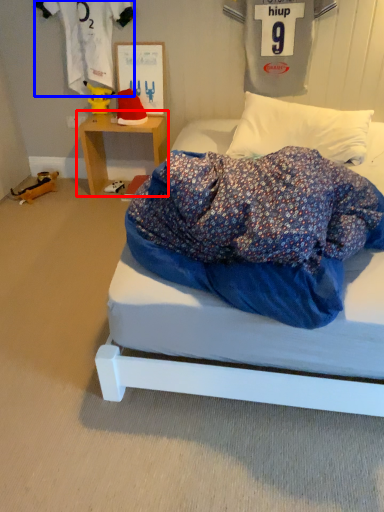
Question: Among these objects, which one is nearest to the camera, table (highlighted by a red box) or clothing (highlighted by a blue box)?

Choices:
 (A) table
 (B) clothing

Answer: (B)